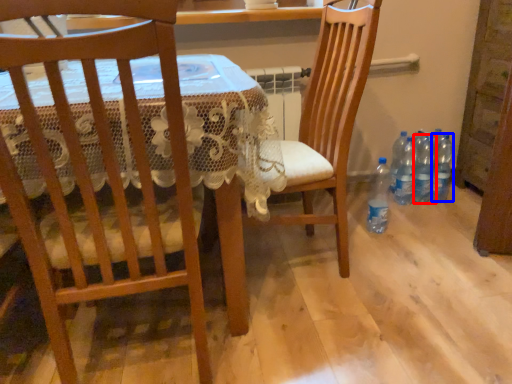
Question: Among these objects, which one is farthest to the camera, bottle (highlighted by a red box) or bottle (highlighted by a blue box)?

Choices:
 (A) bottle
 (B) bottle

Answer: (B)